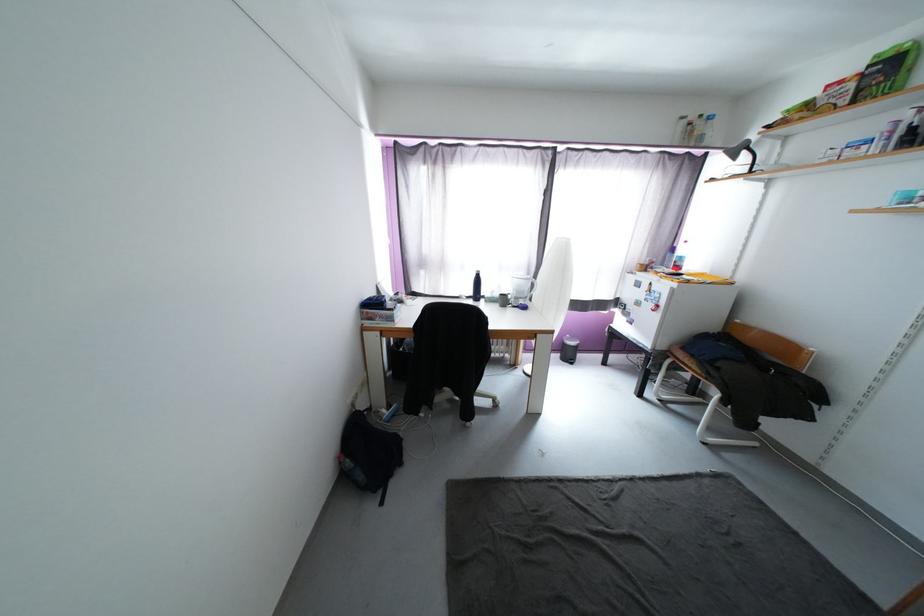
The location [568,349] corresponds to which object?

It corresponds to the small trash bin in the image.